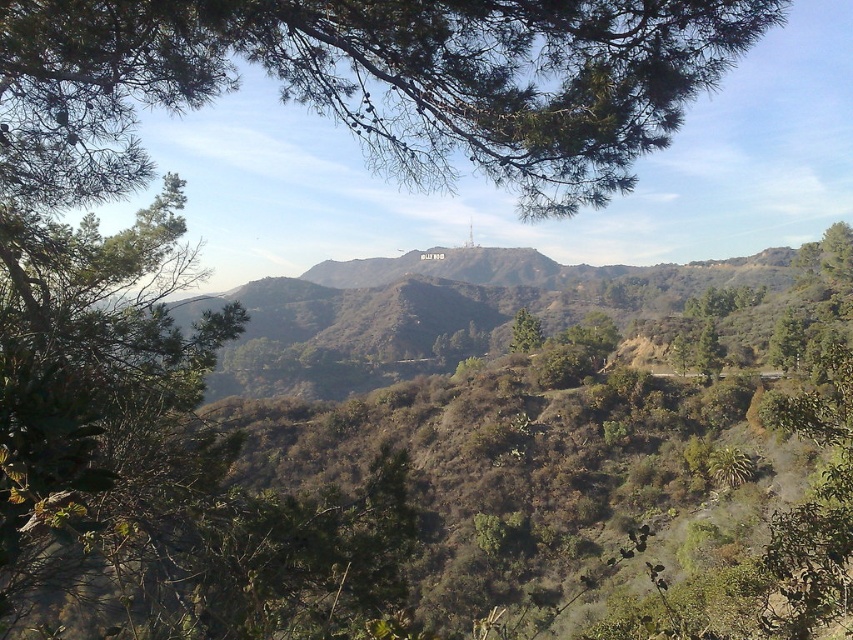
Question: Can you confirm if green needle-like branches at upper left is positioned to the left of green leafy tree at center?

Choices:
 (A) no
 (B) yes

Answer: (B)

Question: Is green needle-like branches at upper left in front of green leafy tree at center?

Choices:
 (A) no
 (B) yes

Answer: (B)

Question: Which object is closer to the camera taking this photo?

Choices:
 (A) green needle-like branches at upper left
 (B) green leafy tree at center

Answer: (A)

Question: Among these objects, which one is farthest from the camera?

Choices:
 (A) green needle-like branches at upper left
 (B) green leafy tree at center

Answer: (B)

Question: Is green needle-like branches at upper left to the right of green leafy tree at center from the viewer's perspective?

Choices:
 (A) no
 (B) yes

Answer: (A)